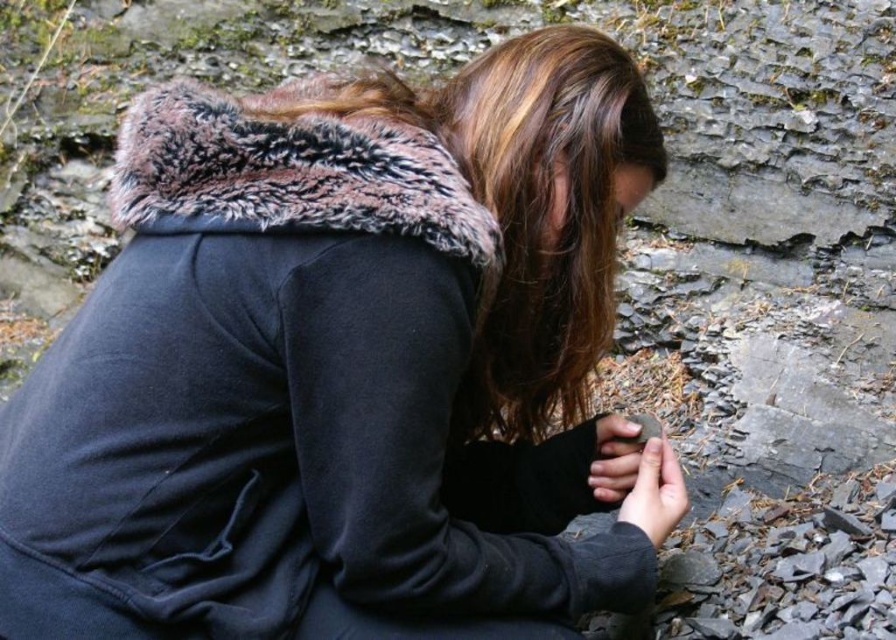
Is brown matte hair at center shorter than smooth brown stone at lower center?

No, brown matte hair at center is not shorter than smooth brown stone at lower center.

Does brown matte hair at center appear on the right side of smooth brown stone at lower center?

Incorrect, brown matte hair at center is not on the right side of smooth brown stone at lower center.

Which is in front, point (520, 296) or point (643, 502)?

Point (520, 296) is in front.

At what (x,y) coordinates should I click in order to perform the action: click on brown matte hair at center. Please return your answer as a coordinate pair (x, y). Looking at the image, I should click on (544, 216).

Can you confirm if brown matte hair at center is smaller than smooth gray stone at lower center?

No, brown matte hair at center is not smaller than smooth gray stone at lower center.

Consider the image. Is brown matte hair at center thinner than smooth gray stone at lower center?

No.

Which is behind, point (554, 70) or point (602, 416)?

The point (602, 416) is behind.

Image resolution: width=896 pixels, height=640 pixels. In order to click on brown matte hair at center in this screenshot , I will do `click(544, 216)`.

Between black fleece jacket at center and smooth brown stone at lower center, which one has more height?

With more height is black fleece jacket at center.

Between point (438, 632) and point (645, 525), which one is positioned in front?

Point (438, 632) is in front.

At what (x,y) coordinates should I click in order to perform the action: click on black fleece jacket at center. Please return your answer as a coordinate pair (x, y). Looking at the image, I should click on (339, 364).